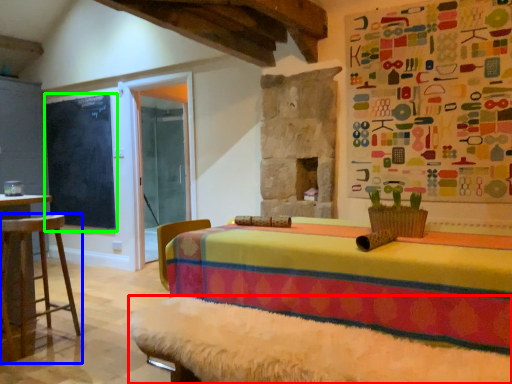
Question: Which object is positioned farthest from bed frame (highlighted by a red box)? Select from furniture (highlighted by a blue box) and bulletin board (highlighted by a green box).

Choices:
 (A) furniture
 (B) bulletin board

Answer: (B)